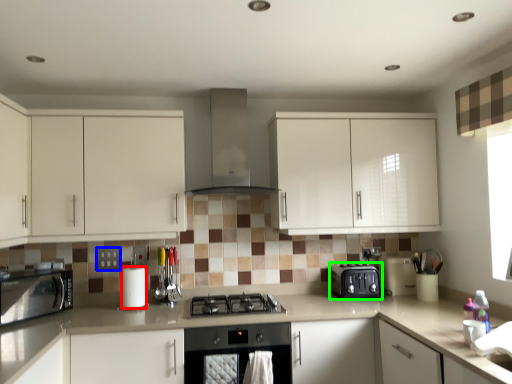
Question: Which is nearer to the paper towel (highlighted by a red box)? square (highlighted by a blue box) or kitchen appliance (highlighted by a green box).

Choices:
 (A) square
 (B) kitchen appliance

Answer: (A)